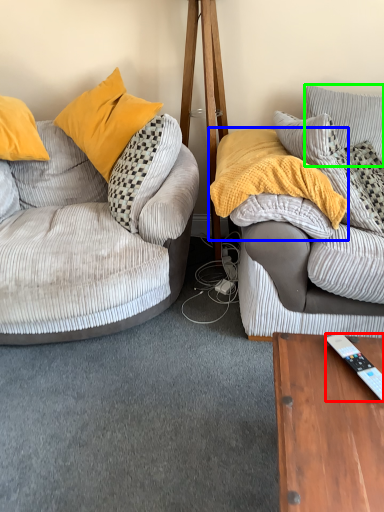
Question: Which object is positioned farthest from remote control (highlighted by a red box)? Select from material (highlighted by a blue box) and pillow (highlighted by a green box).

Choices:
 (A) material
 (B) pillow

Answer: (B)